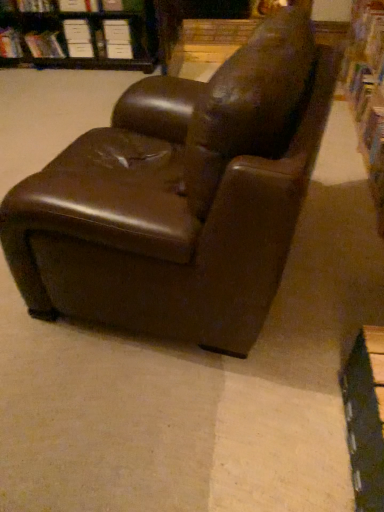
You are a GUI agent. You are given a task and a screenshot of the screen. Output one action in this format:
    pyautogui.click(x=<x>, y=<y>)
    Task: Click on the vacant space in front of brown leather chair at center
    This screenshot has width=384, height=512.
    Given the screenshot: What is the action you would take?
    pyautogui.click(x=167, y=413)